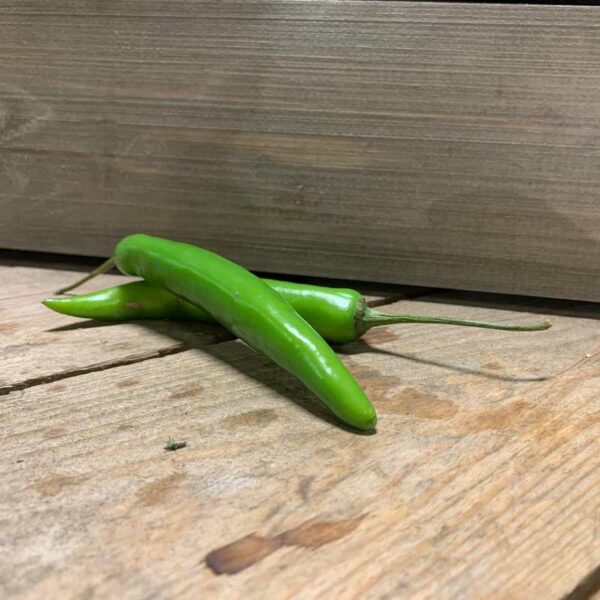
Find the location of a particular element. gray wall is located at coordinates (335, 118).